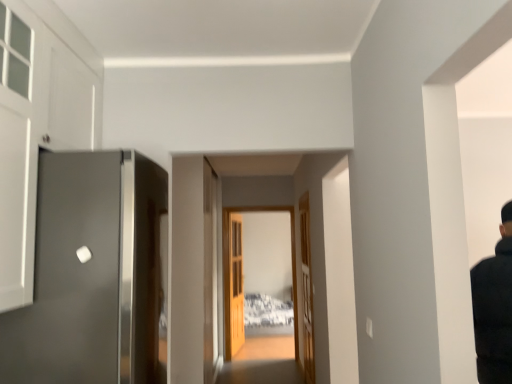
Question: Is wooden door at center, which ranks as the 2th door in right-to-left order, wider than clear glass door at center?

Choices:
 (A) yes
 (B) no

Answer: (B)

Question: Would you say clear glass door at center is part of wooden door at center, which appears as the second door when viewed from the left,'s contents?

Choices:
 (A) yes
 (B) no

Answer: (B)

Question: Can you confirm if wooden door at center, which appears as the second door when viewed from the left, is positioned to the right of clear glass door at center?

Choices:
 (A) yes
 (B) no

Answer: (B)

Question: Considering the relative sizes of wooden door at center, which appears as the 3th door when viewed from the front, and clear glass door at center in the image provided, is wooden door at center, which appears as the 3th door when viewed from the front, shorter than clear glass door at center?

Choices:
 (A) yes
 (B) no

Answer: (A)

Question: Is wooden door at center, positioned as the 1th door in back-to-front order, facing towards clear glass door at center?

Choices:
 (A) yes
 (B) no

Answer: (A)

Question: Considering the relative positions of wooden door at center, which ranks as the 2th door in right-to-left order, and clear glass door at center in the image provided, is wooden door at center, which ranks as the 2th door in right-to-left order, to the left of clear glass door at center from the viewer's perspective?

Choices:
 (A) yes
 (B) no

Answer: (A)

Question: Is wooden door at center, the second door when ordered from back to front, positioned with its back to wooden door at center, positioned as the 1th door in back-to-front order?

Choices:
 (A) yes
 (B) no

Answer: (B)

Question: From the image's perspective, is wooden door at center, which appears as the 1th door when viewed from the right, located above wooden door at center, which appears as the second door when viewed from the left?

Choices:
 (A) no
 (B) yes

Answer: (B)

Question: Is wooden door at center, acting as the third door starting from the left, at the right side of wooden door at center, positioned as the 1th door in back-to-front order?

Choices:
 (A) no
 (B) yes

Answer: (B)

Question: Is wooden door at center, acting as the third door starting from the left, surrounding wooden door at center, which appears as the 3th door when viewed from the front?

Choices:
 (A) yes
 (B) no

Answer: (B)

Question: Considering the relative sizes of wooden door at center, acting as the third door starting from the left, and wooden door at center, which appears as the second door when viewed from the left, in the image provided, is wooden door at center, acting as the third door starting from the left, bigger than wooden door at center, which appears as the second door when viewed from the left,?

Choices:
 (A) yes
 (B) no

Answer: (B)

Question: From the image's perspective, is wooden door at center, acting as the third door starting from the left, located beneath wooden door at center, which appears as the second door when viewed from the left?

Choices:
 (A) no
 (B) yes

Answer: (A)

Question: Is clear glass door at center to the right of wooden door at center, which appears as the second door when viewed from the left, from the viewer's perspective?

Choices:
 (A) no
 (B) yes

Answer: (B)